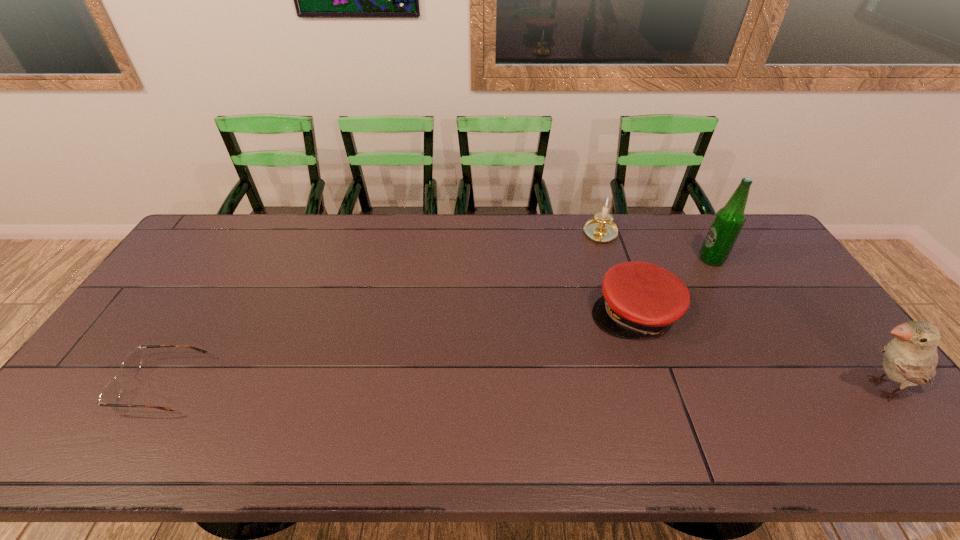
You are a GUI agent. You are given a task and a screenshot of the screen. Output one action in this format:
    pyautogui.click(x=<x>, y=<y>)
    Task: Click on the vacant spot on the desktop that is between the spectacles and the rightmost object and is positioned on the front-facing side of the second shortest object
    This screenshot has width=960, height=540.
    Given the screenshot: What is the action you would take?
    pyautogui.click(x=612, y=387)

At what (x,y) coordinates should I click in order to perform the action: click on vacant space on the desktop that is between the spectacles and the bird and is positioned on the handle side of the candle holder. Please return your answer as a coordinate pair (x, y). Looking at the image, I should click on (593, 387).

Identify the location of vacant space on the desktop that is between the spectacles and the bird and is positioned on the label of the tallest object. (569, 387).